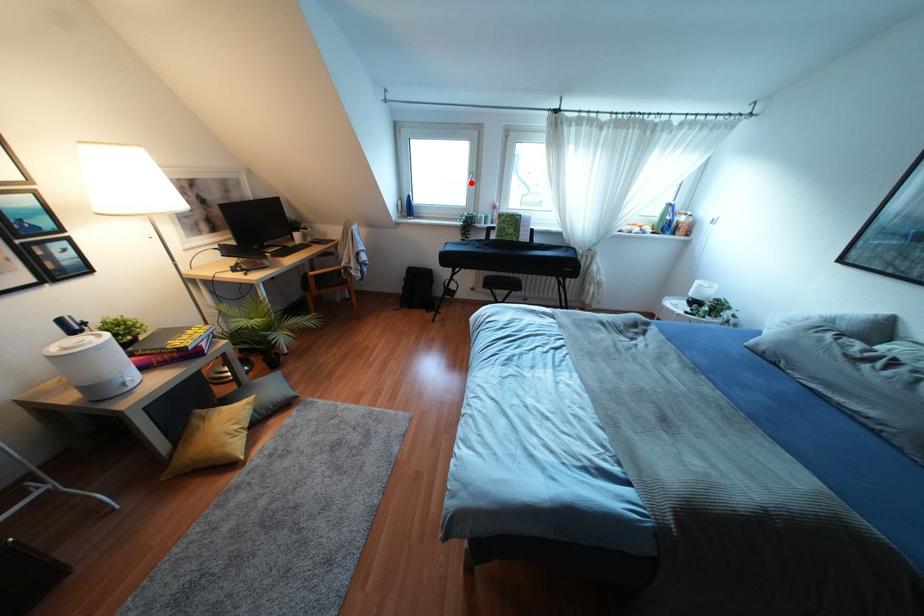
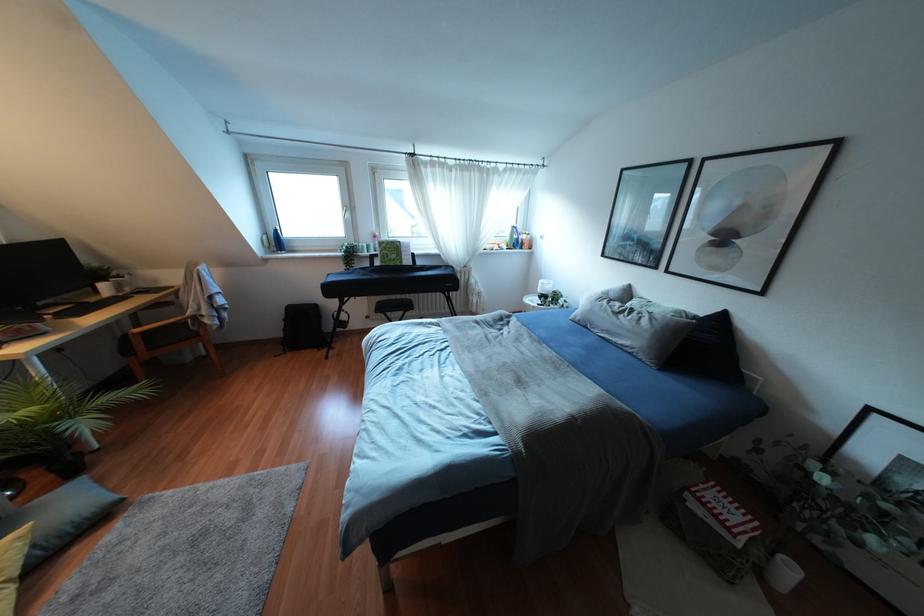
In the second image, find the point that corresponds to the highlighted location in the first image.

(346, 215)